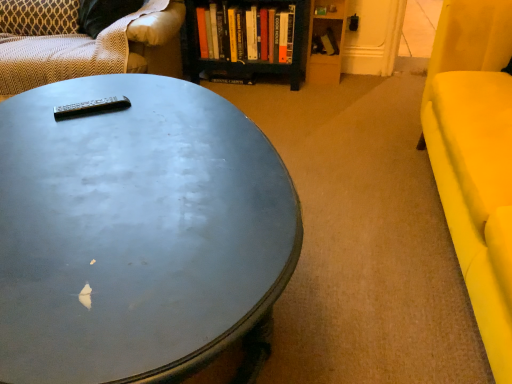
Locate an element on the screen. Image resolution: width=512 pixels, height=384 pixels. blank space situated above metallic gray coffee table at center (from a real-world perspective) is located at coordinates (136, 176).